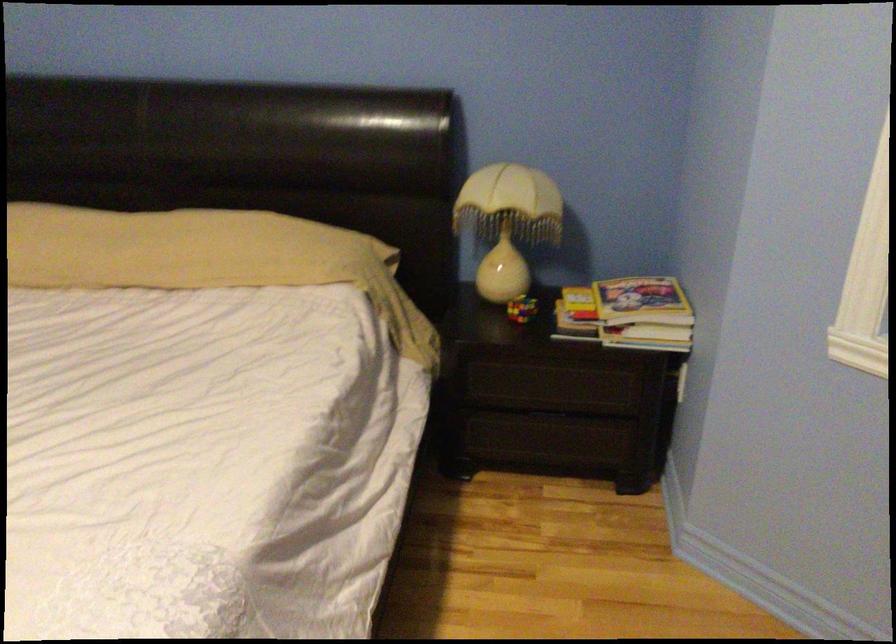
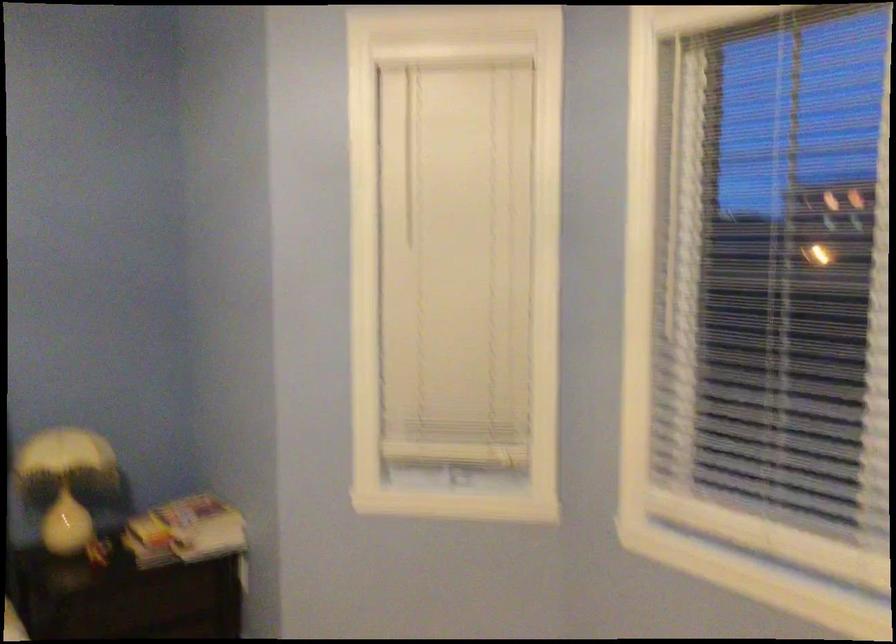
Question: The camera is either moving clockwise (left) or counter-clockwise (right) around the object. The first image is from the beginning of the video and the second image is from the end. Is the camera moving left or right when shooting the video?

Choices:
 (A) Left
 (B) Right

Answer: (A)